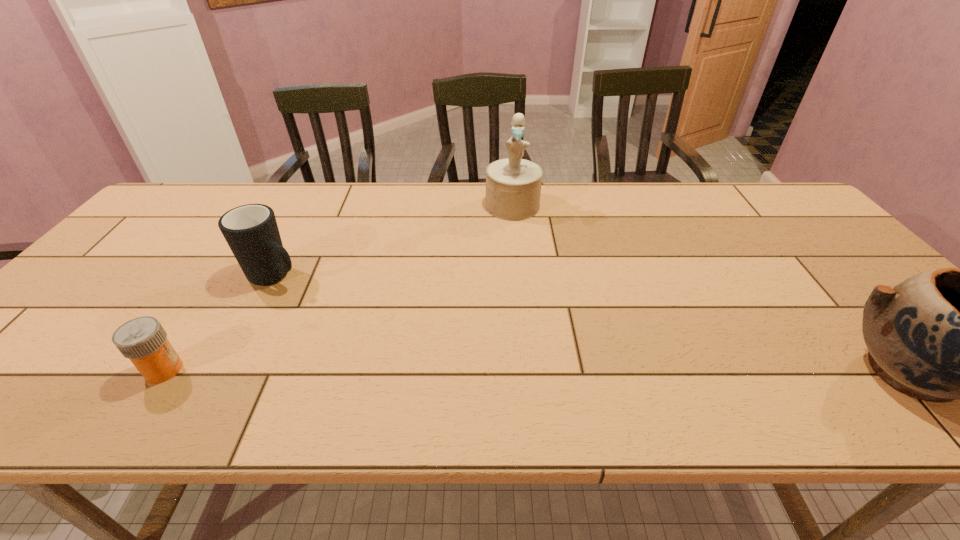
Where is `free spot between the farthest object and the third object from right to left`? This screenshot has width=960, height=540. free spot between the farthest object and the third object from right to left is located at coordinates (395, 241).

Where is `vacant area that lies between the farthest object and the second shortest object`? The width and height of the screenshot is (960, 540). vacant area that lies between the farthest object and the second shortest object is located at coordinates (395, 241).

At what (x,y) coordinates should I click in order to perform the action: click on empty space between the farthest object and the leftmost object. Please return your answer as a coordinate pair (x, y). This screenshot has height=540, width=960. Looking at the image, I should click on (338, 288).

Find the location of a particular element. The width and height of the screenshot is (960, 540). free space between the third nearest object and the tallest object is located at coordinates (395, 241).

The image size is (960, 540). Identify the location of object that ranks as the closest to the third tallest object. tap(143, 340).

Point out which object is positioned as the nearest to the second shortest object. Please provide its 2D coordinates. Your answer should be formatted as a tuple, i.e. [(x, y)], where the tuple contains the x and y coordinates of a point satisfying the conditions above.

[(143, 340)]